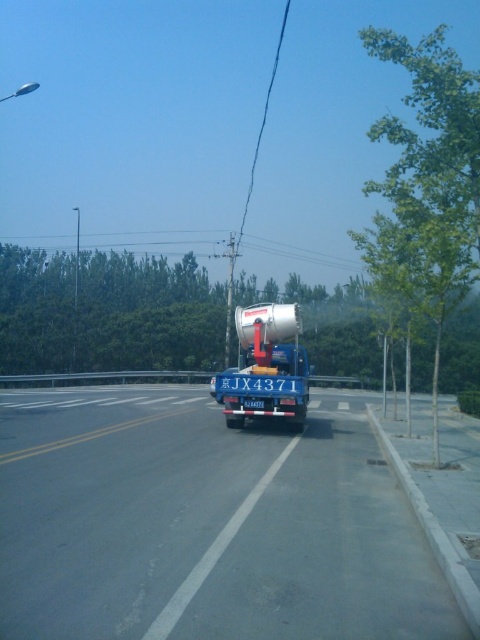
Question: Which point appears farthest from the camera in this image?

Choices:
 (A) (240, 365)
 (B) (395, 528)

Answer: (A)

Question: Is blue metallic truck at center wider than silver metallic trailer truck at center?

Choices:
 (A) no
 (B) yes

Answer: (B)

Question: Can you confirm if blue metallic truck at center is wider than silver metallic trailer truck at center?

Choices:
 (A) yes
 (B) no

Answer: (A)

Question: Considering the relative positions of blue metallic truck at center and silver metallic trailer truck at center in the image provided, where is blue metallic truck at center located with respect to silver metallic trailer truck at center?

Choices:
 (A) above
 (B) below

Answer: (B)